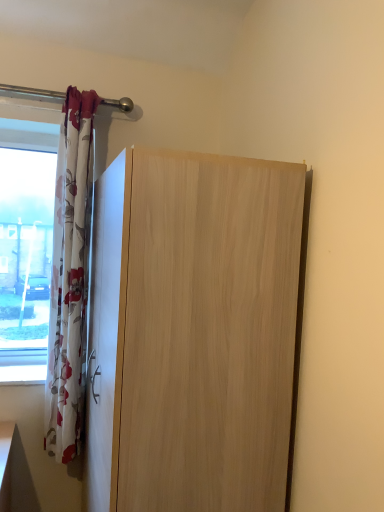
Question: Should I look upward or downward to see floral fabric curtain at left?

Choices:
 (A) up
 (B) down

Answer: (B)

Question: Could floral fabric curtain at left be considered to be inside light wood cupboard at center?

Choices:
 (A) yes
 (B) no

Answer: (B)

Question: From a real-world perspective, is light wood cupboard at center located higher than floral fabric curtain at left?

Choices:
 (A) yes
 (B) no

Answer: (B)

Question: Can you confirm if light wood cupboard at center is shorter than floral fabric curtain at left?

Choices:
 (A) no
 (B) yes

Answer: (B)

Question: Is light wood cupboard at center wider than floral fabric curtain at left?

Choices:
 (A) yes
 (B) no

Answer: (A)

Question: Considering the relative sizes of light wood cupboard at center and floral fabric curtain at left in the image provided, is light wood cupboard at center smaller than floral fabric curtain at left?

Choices:
 (A) yes
 (B) no

Answer: (B)

Question: Does light wood cupboard at center come behind floral fabric curtain at left?

Choices:
 (A) yes
 (B) no

Answer: (B)

Question: Is floral fabric curtain at left wider than light wood cupboard at center?

Choices:
 (A) yes
 (B) no

Answer: (B)

Question: Can you confirm if floral fabric curtain at left is thinner than light wood cupboard at center?

Choices:
 (A) no
 (B) yes

Answer: (B)

Question: Is floral fabric curtain at left aimed at light wood cupboard at center?

Choices:
 (A) yes
 (B) no

Answer: (B)

Question: From a real-world perspective, does floral fabric curtain at left sit lower than light wood cupboard at center?

Choices:
 (A) no
 (B) yes

Answer: (A)

Question: Would you say floral fabric curtain at left contains light wood cupboard at center?

Choices:
 (A) no
 (B) yes

Answer: (A)

Question: Does floral fabric curtain at left have a greater height compared to light wood cupboard at center?

Choices:
 (A) yes
 (B) no

Answer: (A)

Question: Choose the correct answer: Is floral fabric curtain at left inside light wood cupboard at center or outside it?

Choices:
 (A) outside
 (B) inside

Answer: (A)